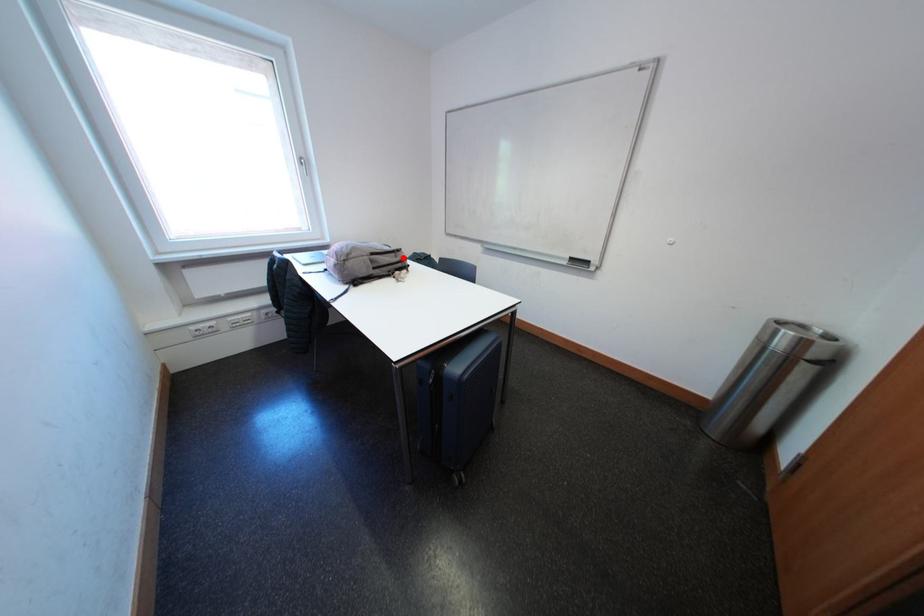
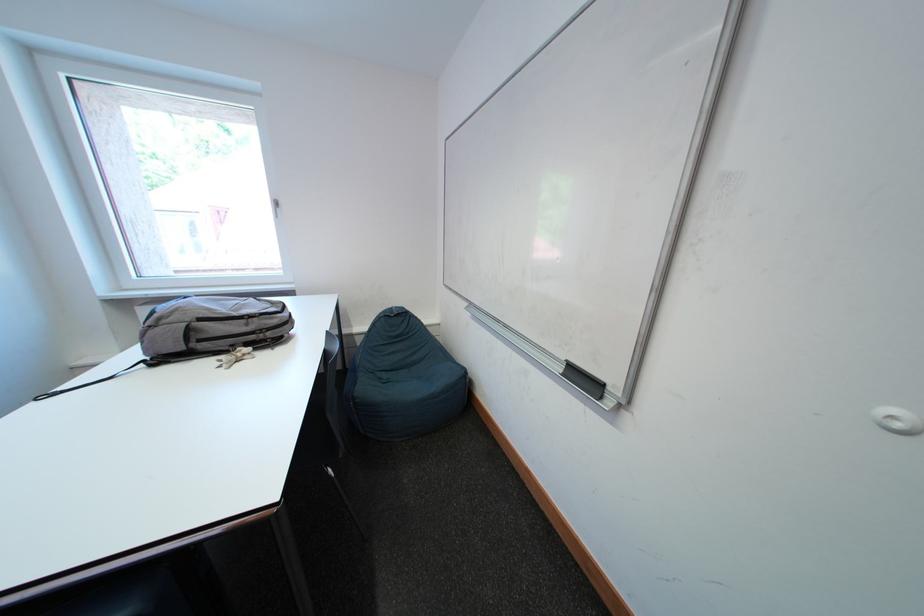
Locate, in the second image, the point that corresponds to the highlighted location in the first image.

(252, 325)